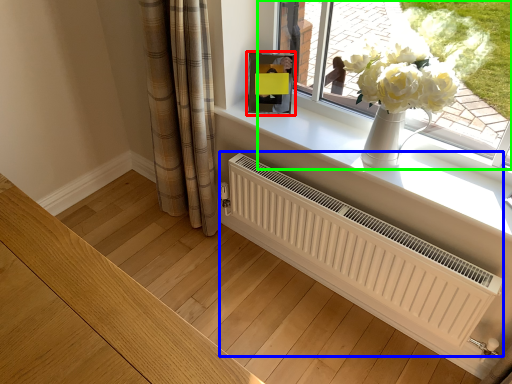
Question: Which object is the farthest from picture frame (highlighted by a red box)? Choose among these: radiator (highlighted by a blue box) or window (highlighted by a green box).

Choices:
 (A) radiator
 (B) window

Answer: (A)